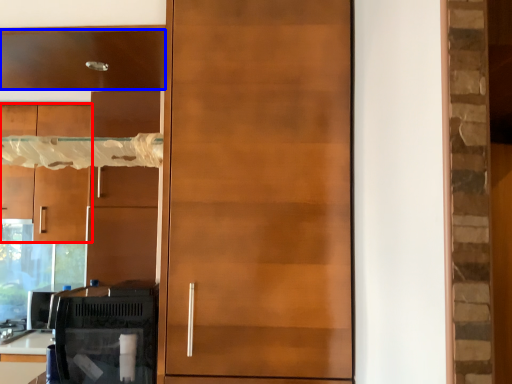
Question: Which object appears farthest to the camera in this image, cabinetry (highlighted by a red box) or cabinetry (highlighted by a blue box)?

Choices:
 (A) cabinetry
 (B) cabinetry

Answer: (A)